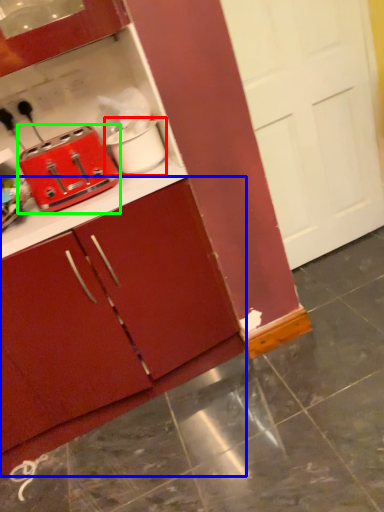
Question: Based on their relative distances, which object is nearer to appliance (highlighted by a red box)? Choose from cabinetry (highlighted by a blue box) and toaster (highlighted by a green box).

Choices:
 (A) cabinetry
 (B) toaster

Answer: (B)